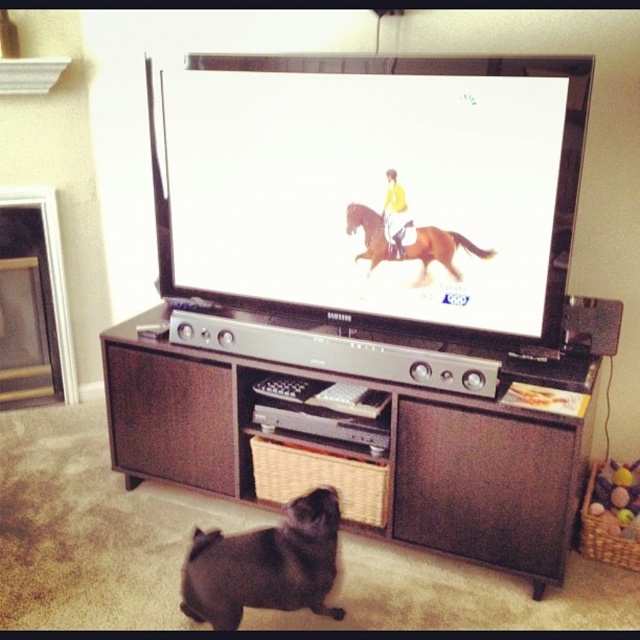
You are trying to hang a picture frame that is 1 meter wide on the wall behind the entertainment unit. The frame must be centered between the white glossy screen at center and the brown glossy horse at center. Can the frame fit between them without overlapping either object?

The white glossy screen at center is wider than the brown glossy horse at center. To determine if the 1 meter wide picture frame can fit between them when centered, we need to know the distance between the two objects. However, the provided information only states their relative sizes, not their spacing. Without knowing the actual distance between them, it is impossible to confirm if the frame will fit without overlapping.

You are standing in front of the television and need to locate the brown glossy horse at center. According to the scene description, where exactly is the brown glossy horse positioned relative to the TV stand?

The brown glossy horse at center is located at point coordinates (410, 243) relative to the TV stand.